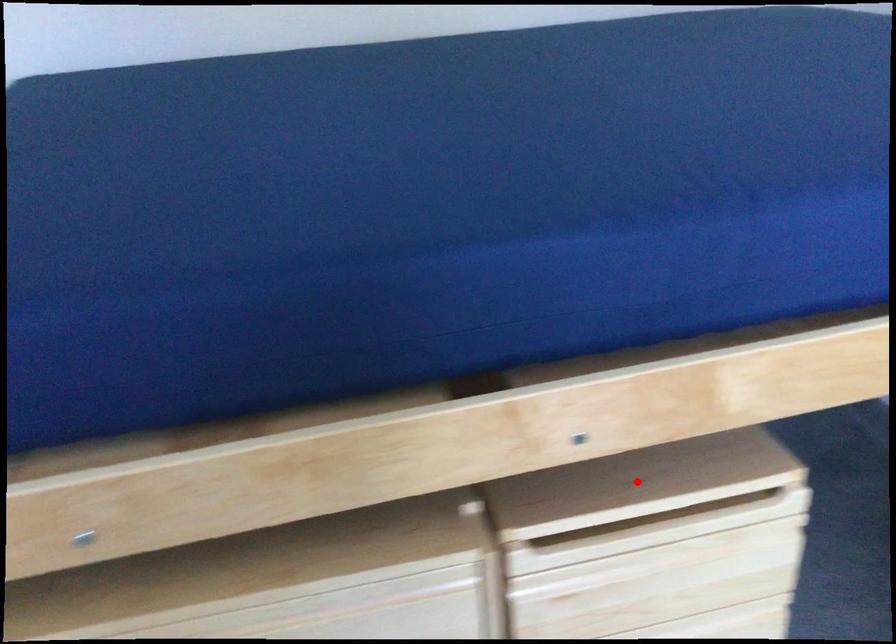
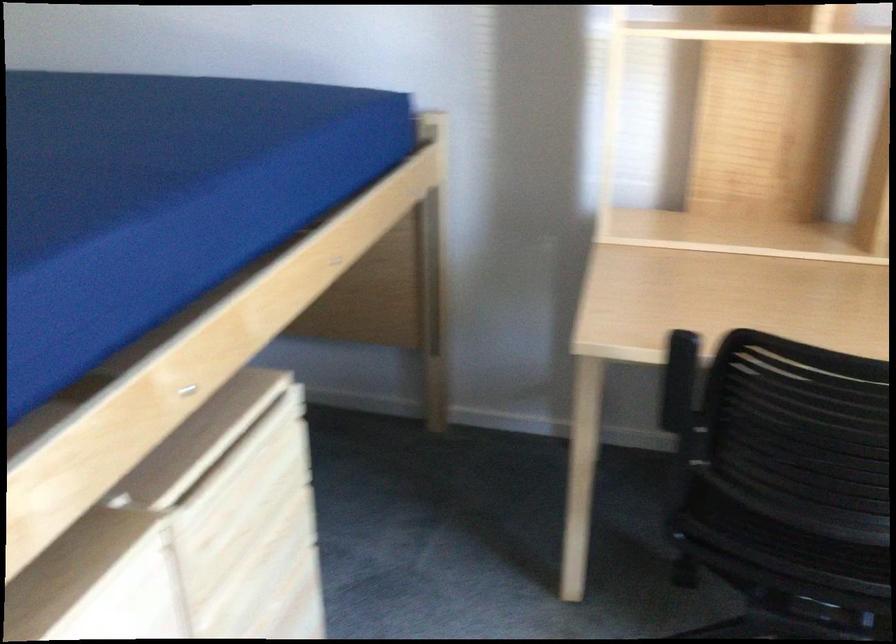
In the second image, find the point that corresponds to the highlighted location in the first image.

(202, 439)